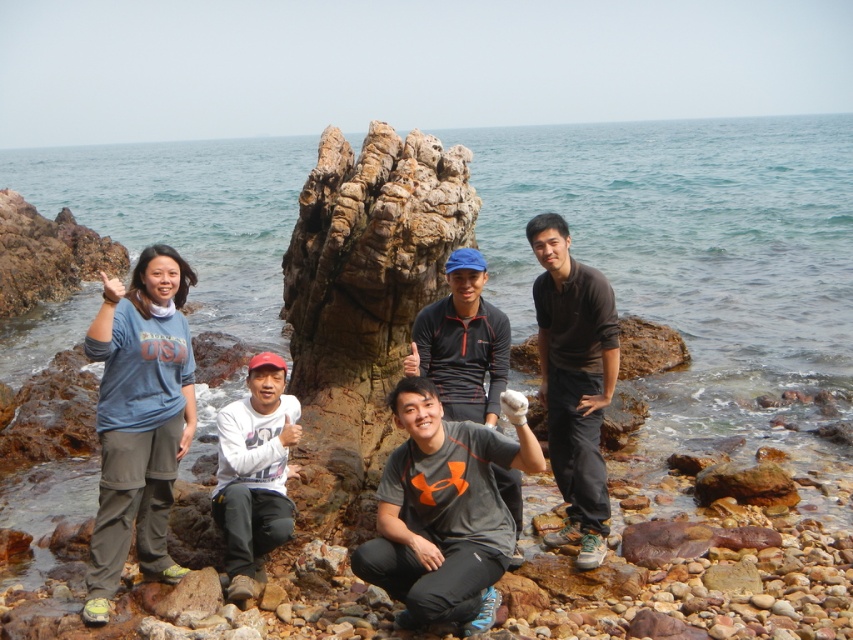
Question: Estimate the real-world distances between objects in this image. Which object is closer to the gray matte t-shirt at center?

Choices:
 (A) blue cotton shirt at center
 (B) rusty stone rock at center
 (C) dark gray fleece jacket at center

Answer: (C)

Question: Is blue cotton shirt at center further to camera compared to dark gray fleece jacket at center?

Choices:
 (A) no
 (B) yes

Answer: (A)

Question: Can you confirm if rusty stone rock at center is positioned to the left of gray matte t-shirt at center?

Choices:
 (A) no
 (B) yes

Answer: (B)

Question: Which of the following is the farthest from the observer?

Choices:
 (A) (477, 339)
 (B) (352, 419)
 (C) (155, 467)

Answer: (B)

Question: From the image, what is the correct spatial relationship of rusty stone rock at center in relation to gray matte t-shirt at center?

Choices:
 (A) above
 (B) below

Answer: (A)

Question: Which is nearer to the blue cotton shirt at center?

Choices:
 (A) black matte shirt at center
 (B) gray matte t-shirt at center
 (C) rusty stone rock at center

Answer: (B)